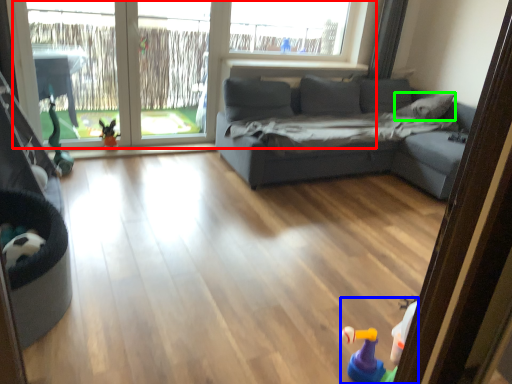
Question: Based on their relative distances, which object is nearer to window (highlighted by a red box)? Choose from toy (highlighted by a blue box) and pillow (highlighted by a green box).

Choices:
 (A) toy
 (B) pillow

Answer: (B)